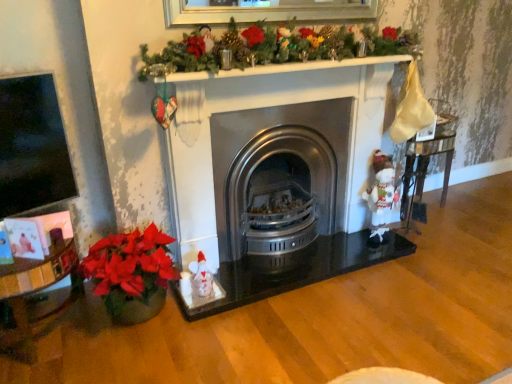
You are a GUI agent. You are given a task and a screenshot of the screen. Output one action in this format:
    pyautogui.click(x=<x>, y=<y>)
    Task: Click on the vacant space in front of stainless steel wood burning stove at center
    This screenshot has height=384, width=512.
    Given the screenshot: What is the action you would take?
    pyautogui.click(x=306, y=315)